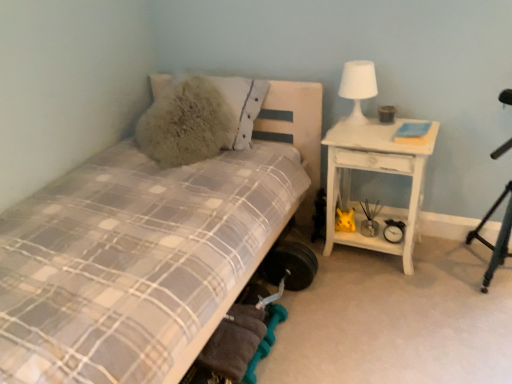
I want to click on free area below teal metallic tripod at right (from a real-world perspective), so click(484, 275).